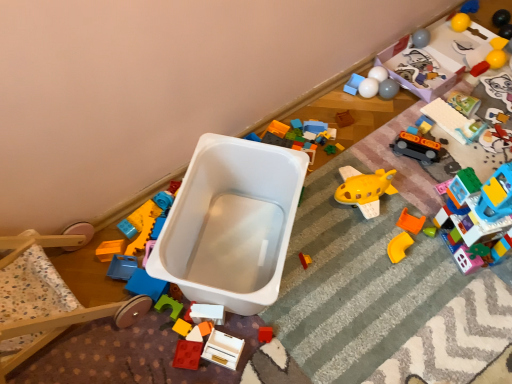
The image size is (512, 384). In order to click on vacant space that is to the left of matte yellow toy airplane at center, placed as the 12th toy when sorted from right to left in this screenshot , I will do `click(243, 261)`.